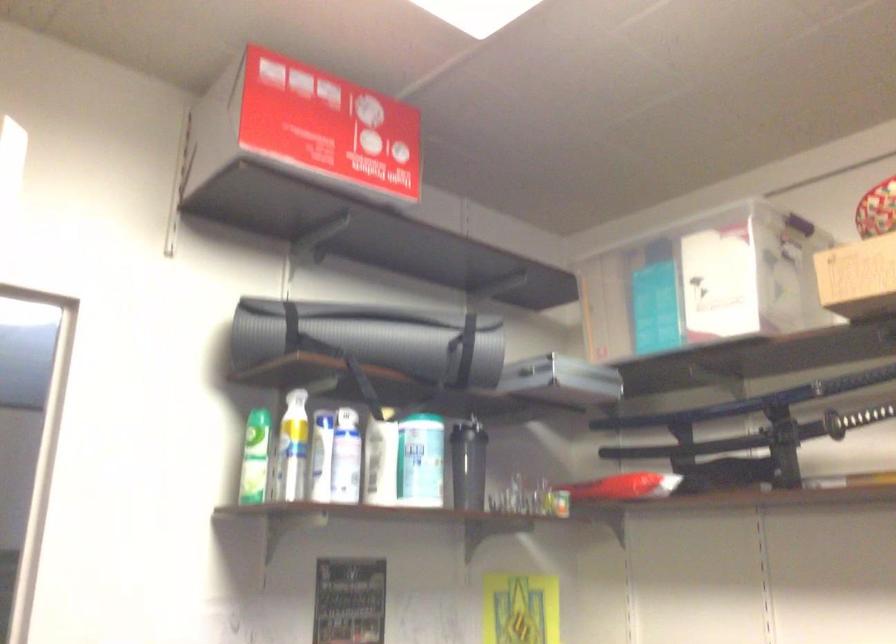
Locate an element on the screen. black shaker bottle is located at coordinates (468, 464).